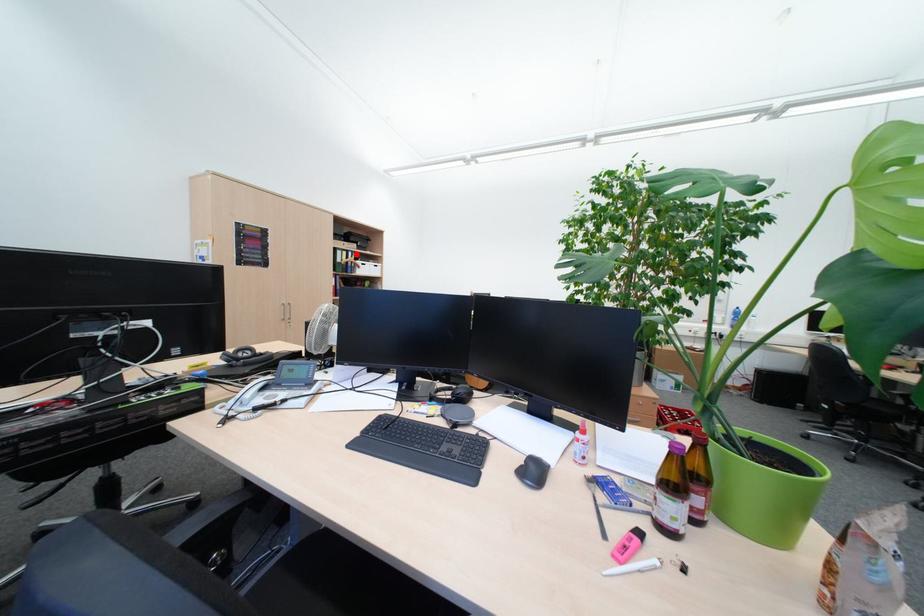
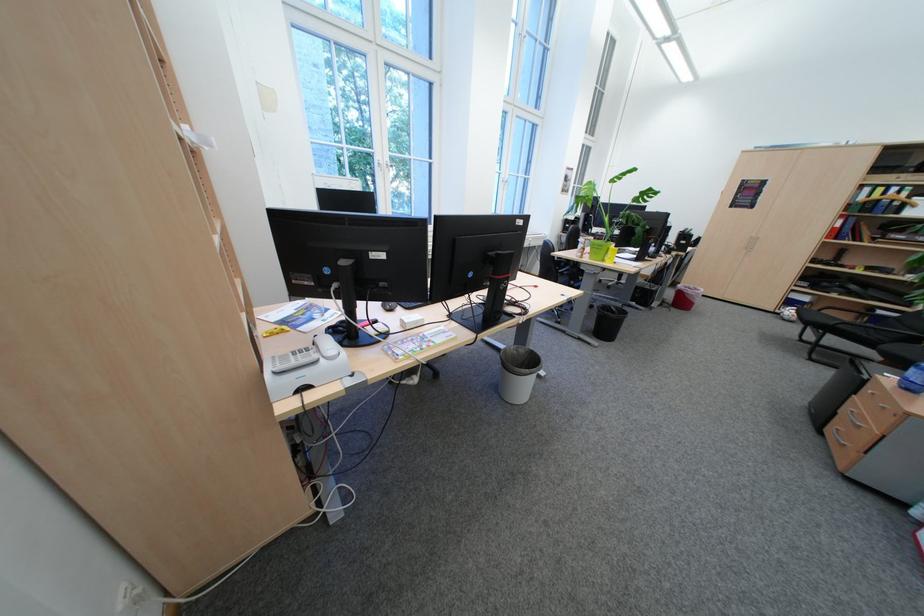
Find the pixel in the second image that matches the highlighted location in the first image.

(893, 190)